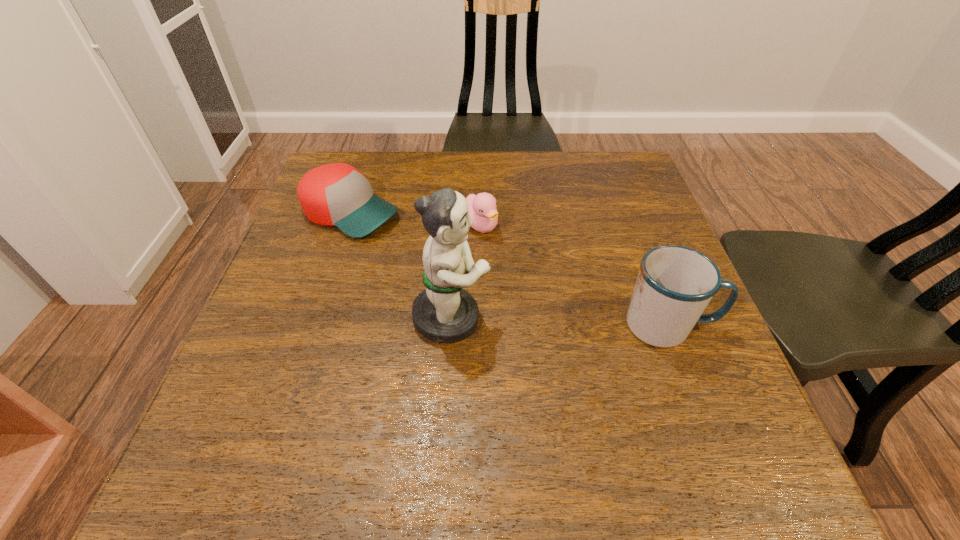
Locate an element on the screen. vacant position located 0.050m on the front-facing side of the duckling is located at coordinates (504, 250).

Where is `vacant position located 0.400m on the front-facing side of the duckling`? The image size is (960, 540). vacant position located 0.400m on the front-facing side of the duckling is located at coordinates (621, 354).

Locate an element on the screen. Image resolution: width=960 pixels, height=540 pixels. object positioned at the far edge is located at coordinates (337, 194).

Where is `object at the left edge`? This screenshot has height=540, width=960. object at the left edge is located at coordinates (337, 194).

This screenshot has height=540, width=960. What are the coordinates of `object that is at the right edge` in the screenshot? It's located at tap(675, 284).

This screenshot has width=960, height=540. I want to click on object present at the far left corner, so [x=337, y=194].

Where is `vacant space at the far edge`? This screenshot has width=960, height=540. vacant space at the far edge is located at coordinates (409, 191).

I want to click on vacant position at the near edge of the desktop, so click(608, 411).

At what (x,y) coordinates should I click in order to perform the action: click on free space at the left edge of the desktop. Please return your answer as a coordinate pair (x, y). This screenshot has width=960, height=540. Looking at the image, I should click on (319, 245).

Find the location of a particular element. free space at the right edge of the desktop is located at coordinates (665, 235).